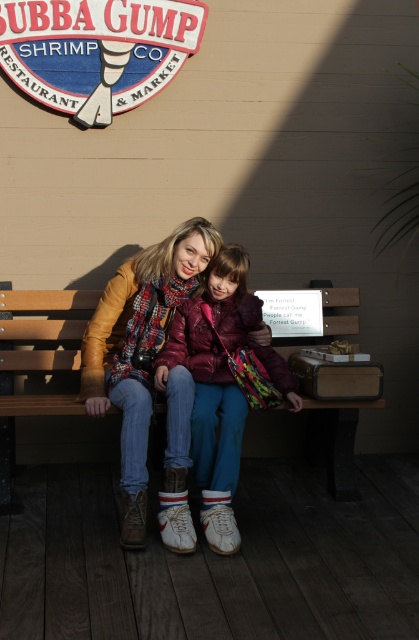
Question: Is wooden sign at upper left thinner than matte purple jacket at center?

Choices:
 (A) yes
 (B) no

Answer: (B)

Question: Which object is closer to the camera taking this photo?

Choices:
 (A) matte plaid scarf at center
 (B) matte purple jacket at center
 (C) wooden sign at upper left

Answer: (B)

Question: Can you confirm if matte plaid scarf at center is smaller than wooden sign at upper left?

Choices:
 (A) yes
 (B) no

Answer: (B)

Question: Which point is closer to the camera?

Choices:
 (A) matte plaid scarf at center
 (B) wooden sign at upper left

Answer: (A)

Question: Estimate the real-world distances between objects in this image. Which object is farther from the matte plaid scarf at center?

Choices:
 (A) matte purple jacket at center
 (B) wooden sign at upper left
 (C) wooden bench at center

Answer: (B)

Question: Does wooden sign at upper left have a larger size compared to wooden bench at center?

Choices:
 (A) no
 (B) yes

Answer: (A)